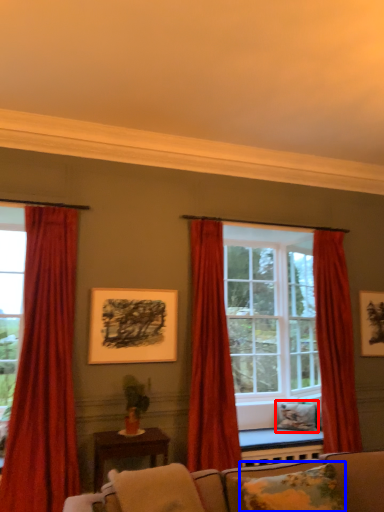
Question: Which object is closer to the camera taking this photo, pillow (highlighted by a red box) or pillow (highlighted by a blue box)?

Choices:
 (A) pillow
 (B) pillow

Answer: (B)